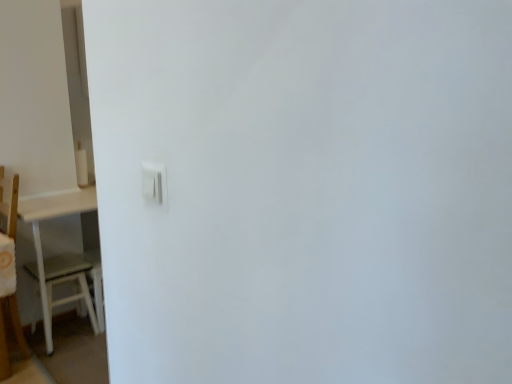
Question: Could white plastic light switch at center be considered to be inside white wooden table at left?

Choices:
 (A) yes
 (B) no

Answer: (B)

Question: Does white wooden table at left have a lesser height compared to white plastic light switch at center?

Choices:
 (A) yes
 (B) no

Answer: (B)

Question: Can you confirm if white wooden table at left is smaller than white plastic light switch at center?

Choices:
 (A) yes
 (B) no

Answer: (B)

Question: Is white wooden table at left to the left of white plastic light switch at center from the viewer's perspective?

Choices:
 (A) yes
 (B) no

Answer: (A)

Question: Is white wooden table at left aimed at white plastic light switch at center?

Choices:
 (A) no
 (B) yes

Answer: (A)

Question: Is white plastic light switch at center at the back of white wooden table at left?

Choices:
 (A) no
 (B) yes

Answer: (A)

Question: Does white matte table at left lie in front of white wooden table at left?

Choices:
 (A) no
 (B) yes

Answer: (A)

Question: Is white matte table at left completely or partially outside of white wooden table at left?

Choices:
 (A) no
 (B) yes

Answer: (B)

Question: Is white matte table at left wider than white wooden table at left?

Choices:
 (A) yes
 (B) no

Answer: (A)

Question: Is white matte table at left shorter than white wooden table at left?

Choices:
 (A) yes
 (B) no

Answer: (A)

Question: Would you say white matte table at left is a long distance from white wooden table at left?

Choices:
 (A) yes
 (B) no

Answer: (B)

Question: From the image's perspective, is white matte table at left below white wooden table at left?

Choices:
 (A) no
 (B) yes

Answer: (B)

Question: From the image's perspective, would you say white plastic light switch at center is shown under white wooden table at left?

Choices:
 (A) no
 (B) yes

Answer: (A)